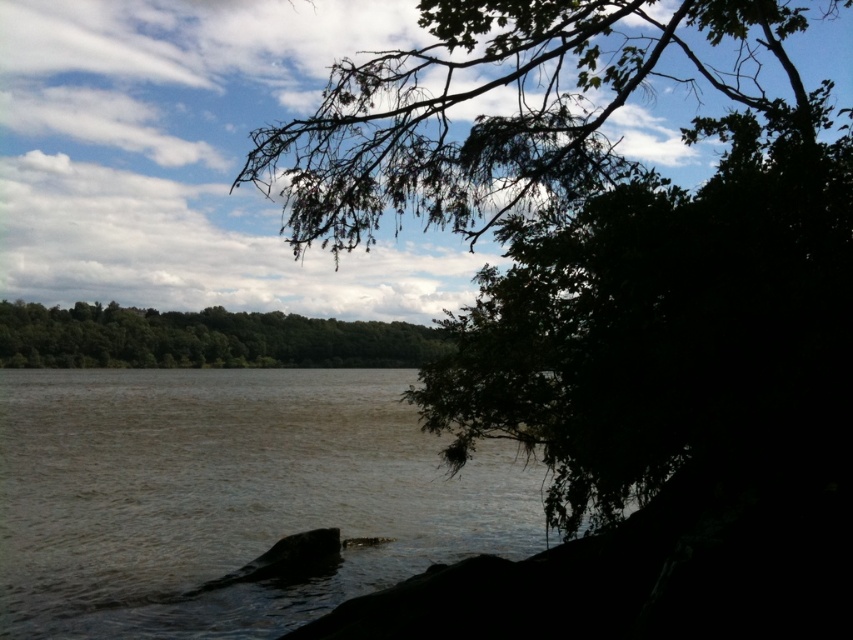
Question: Which point appears farthest from the camera in this image?

Choices:
 (A) (363, 353)
 (B) (22, 429)
 (C) (590, 13)

Answer: (B)

Question: Which is farther from the green leafy branch at upper center?

Choices:
 (A) green leafy trees at center
 (B) brown murky water at center

Answer: (B)

Question: Can you confirm if green leafy branch at upper center is wider than green leafy trees at center?

Choices:
 (A) yes
 (B) no

Answer: (B)

Question: Does brown murky water at center have a greater width compared to green leafy trees at center?

Choices:
 (A) yes
 (B) no

Answer: (A)

Question: Is green leafy branch at upper center above green leafy trees at center?

Choices:
 (A) yes
 (B) no

Answer: (A)

Question: Which of the following is the closest to the observer?

Choices:
 (A) green leafy trees at center
 (B) green leafy branch at upper center

Answer: (B)